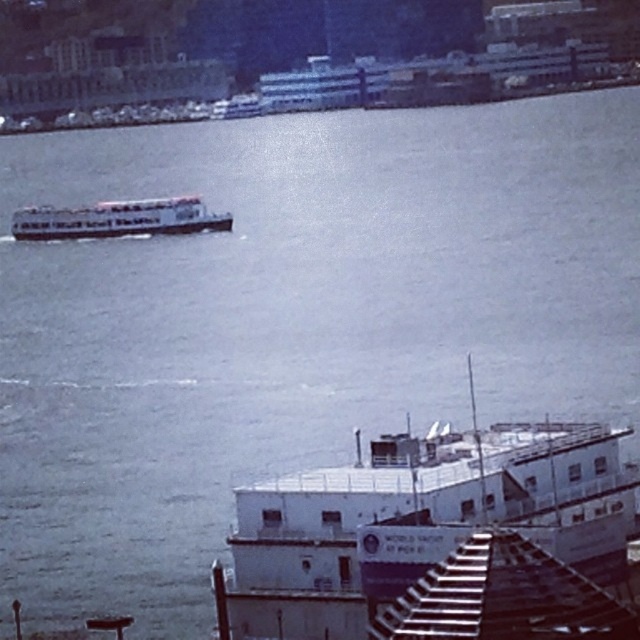
Is white matte boat at lower right bigger than white matte boat at upper left?

Yes, white matte boat at lower right is bigger than white matte boat at upper left.

Which is above, white matte boat at lower right or white matte boat at upper left?

white matte boat at upper left is higher up.

Locate an element on the screen. The height and width of the screenshot is (640, 640). white matte boat at lower right is located at coordinates click(440, 540).